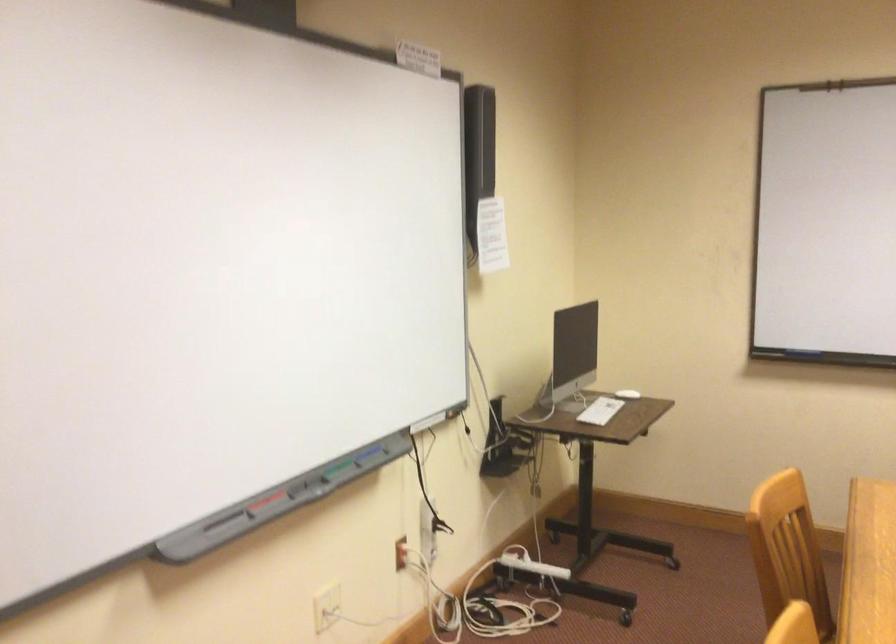
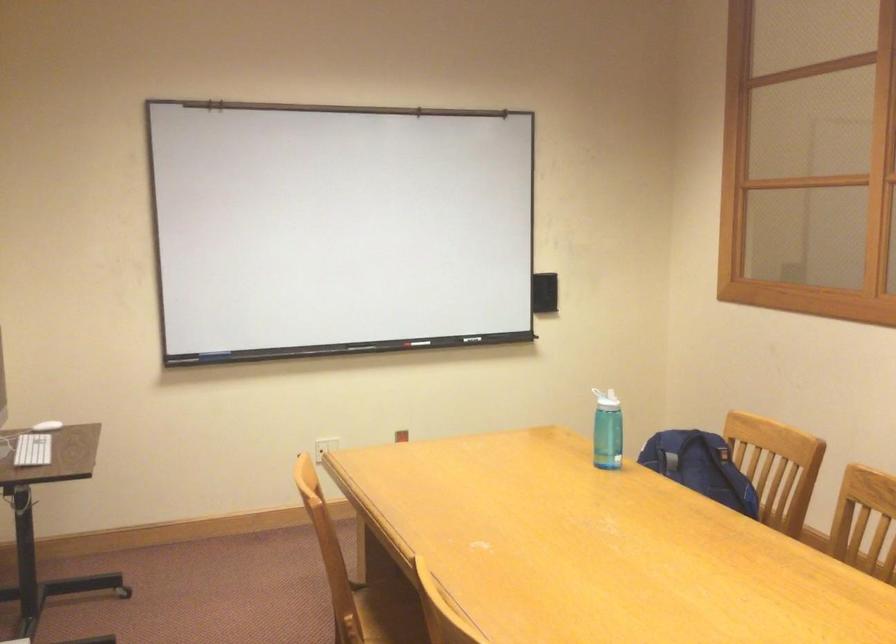
In the second image, find the point that corresponds to (x=640, y=392) in the first image.

(47, 426)